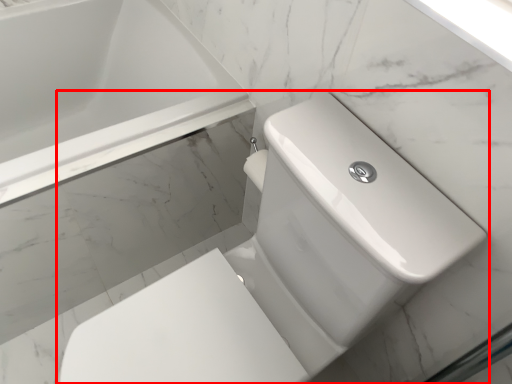
Question: From the image, what is the correct spatial relationship of toilet (annotated by the red box) in relation to bathtub?

Choices:
 (A) left
 (B) right

Answer: (B)